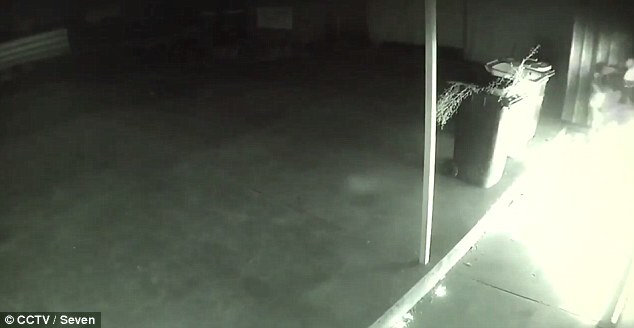
This screenshot has height=328, width=634. Find the location of `floor`. floor is located at coordinates (274, 116).